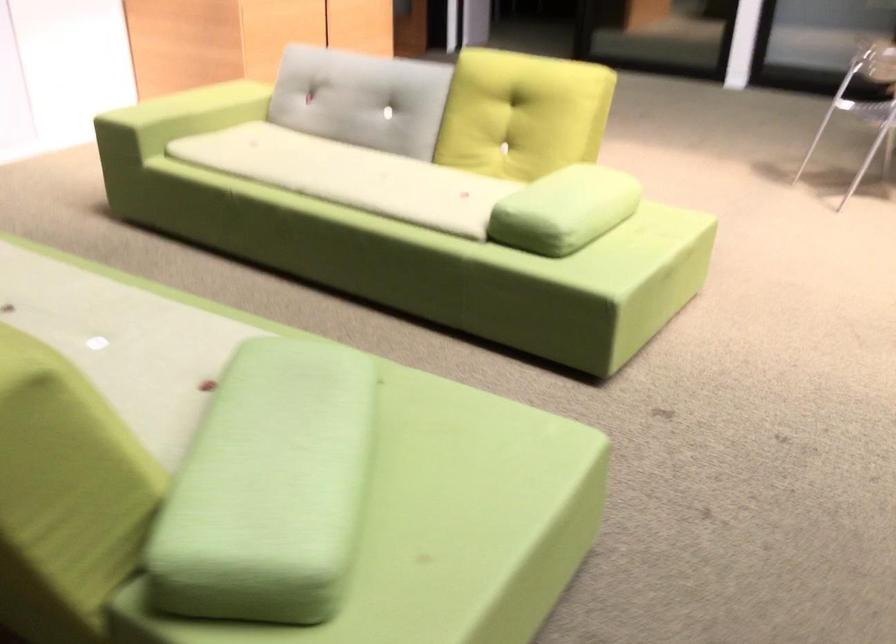
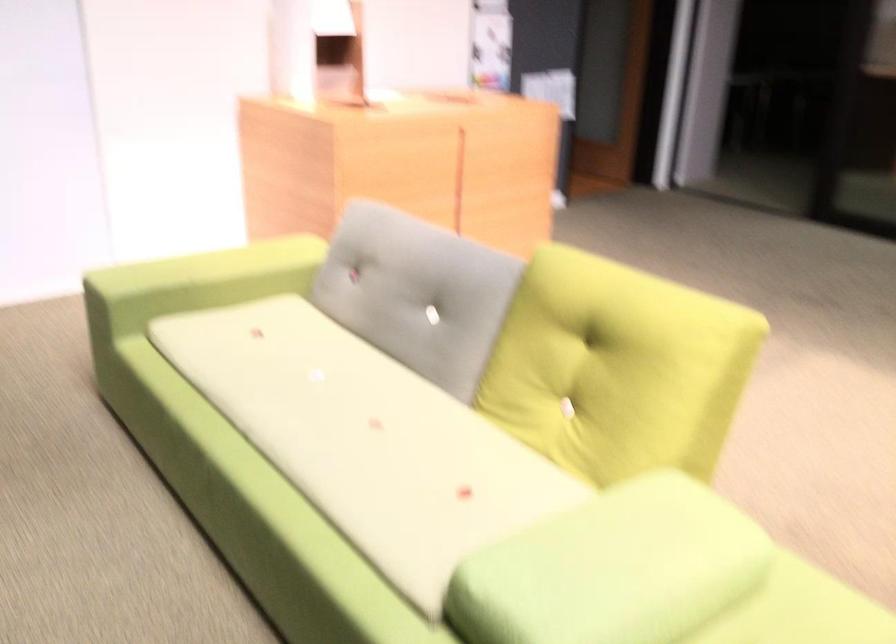
Locate, in the second image, the point that corresponds to point (200, 109) in the first image.

(194, 283)